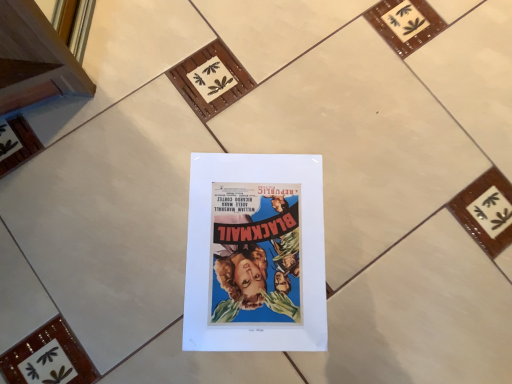
What is the approximate height of matte paper poster at center?

matte paper poster at center is 1.38 centimeters tall.

Locate an element on the screen. matte paper poster at center is located at coordinates (255, 254).

This screenshot has height=384, width=512. What do you see at coordinates (255, 254) in the screenshot? I see `matte paper poster at center` at bounding box center [255, 254].

Measure the distance between point (191, 336) and camera.

Point (191, 336) is 23.98 inches away from camera.

I want to click on matte paper poster at center, so click(x=255, y=254).